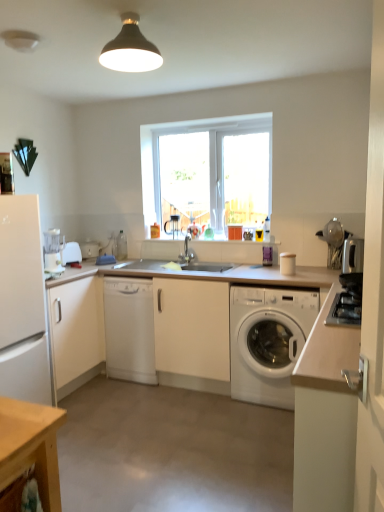
How much space does white plastic toaster at left, placed as the first appliance when sorted from back to front, occupy vertically?

The height of white plastic toaster at left, placed as the first appliance when sorted from back to front, is 18.63 centimeters.

Locate an element on the screen. matte black lampshade at upper center is located at coordinates (130, 49).

The width and height of the screenshot is (384, 512). Describe the element at coordinates (160, 323) in the screenshot. I see `white matte countertop at center` at that location.

Measure the distance between matte silver faucet at center and camera.

The depth of matte silver faucet at center is 3.60 meters.

Where is `white matte cabinet at left, which is the 2th cabinetry from right to left`? white matte cabinet at left, which is the 2th cabinetry from right to left is located at coordinates (76, 333).

Find the location of a particular element. The image size is (384, 512). white plastic toaster at left, placed as the first appliance when sorted from back to front is located at coordinates (70, 253).

Does white matte cabinet at left, which is the first cabinetry from left to right, come in front of transparent glass window at center?

Yes, white matte cabinet at left, which is the first cabinetry from left to right, is in front of transparent glass window at center.

Is white matte cabinet at left, which is the first cabinetry from left to right, oriented away from transparent glass window at center?

No, white matte cabinet at left, which is the first cabinetry from left to right,'s orientation is not away from transparent glass window at center.

Is white matte cabinet at left, which is the 2th cabinetry from right to left, bigger or smaller than transparent glass window at center?

In the image, white matte cabinet at left, which is the 2th cabinetry from right to left, appears to be larger than transparent glass window at center.

Measure the distance between white matte cabinet at left, the second cabinetry positioned from the front, and transparent glass window at center.

white matte cabinet at left, the second cabinetry positioned from the front, and transparent glass window at center are 4.01 feet apart.

Choose the correct answer: Is matte silver faucet at center inside satin silver gas stove at right or outside it?

matte silver faucet at center is not enclosed by satin silver gas stove at right.

Consider the image. Does matte silver faucet at center have a larger size compared to satin silver gas stove at right?

Yes.

Can you confirm if matte silver faucet at center is wider than satin silver gas stove at right?

Yes.

Is satin silver gas stove at right at the back of matte silver faucet at center?

No, satin silver gas stove at right is not at the back of matte silver faucet at center.

Considering the relative sizes of white matte countertop at center and white plastic washing machine at center in the image provided, is white matte countertop at center smaller than white plastic washing machine at center?

Actually, white matte countertop at center might be larger than white plastic washing machine at center.

Is white matte countertop at center at the right side of white plastic washing machine at center?

In fact, white matte countertop at center is to the left of white plastic washing machine at center.

Could you tell me if white matte countertop at center is turned towards white plastic washing machine at center?

Yes, white matte countertop at center is turned towards white plastic washing machine at center.

Are white matte countertop at center and white plastic washing machine at center beside each other?

white matte countertop at center and white plastic washing machine at center are not in contact.

Is white matte dishwasher at center taller or shorter than satin silver toaster at right, the first appliance when ordered from right to left?

In the image, white matte dishwasher at center appears to be taller than satin silver toaster at right, the first appliance when ordered from right to left.

From the image's perspective, relative to satin silver toaster at right, the first appliance when ordered from right to left, is white matte dishwasher at center above or below?

Based on their image positions, white matte dishwasher at center is located beneath satin silver toaster at right, the first appliance when ordered from right to left.

Is white matte dishwasher at center far from satin silver toaster at right, which is counted as the third appliance, starting from the left?

Yes, white matte dishwasher at center is far from satin silver toaster at right, which is counted as the third appliance, starting from the left.

Does white matte dishwasher at center turn towards satin silver toaster at right, the first appliance when ordered from right to left?

No, white matte dishwasher at center does not turn towards satin silver toaster at right, the first appliance when ordered from right to left.

Is satin silver toaster at right, which is counted as the third appliance, starting from the left, positioned in front of metallic silver spoon at upper right, which appears as the second appliance when viewed from the back?

Yes, satin silver toaster at right, which is counted as the third appliance, starting from the left, is closer to the camera.

Between satin silver toaster at right, the first appliance when ordered from right to left, and metallic silver spoon at upper right, which is counted as the second appliance, starting from the left, which one appears on the left side from the viewer's perspective?

From the viewer's perspective, metallic silver spoon at upper right, which is counted as the second appliance, starting from the left, appears more on the left side.

Is satin silver toaster at right, the first appliance when ordered from right to left, with metallic silver spoon at upper right, which appears as the second appliance when viewed from the front?

They are not placed beside each other.

How far apart are satin silver toaster at right, the third appliance from the back, and metallic silver spoon at upper right, which appears as the second appliance when viewed from the front?

They are 7.35 inches apart.

From the picture: Is matte silver faucet at center facing towards white matte cabinet at left, which is the first cabinetry from left to right?

No, matte silver faucet at center is not oriented towards white matte cabinet at left, which is the first cabinetry from left to right.

Would you say matte silver faucet at center is outside white matte cabinet at left, which is the first cabinetry from left to right?

matte silver faucet at center lies outside white matte cabinet at left, which is the first cabinetry from left to right,'s area.

From a real-world perspective, is matte silver faucet at center positioned over white matte cabinet at left, the second cabinetry positioned from the front, based on gravity?

Yes, from a real-world perspective, matte silver faucet at center is over white matte cabinet at left, the second cabinetry positioned from the front

Which is further, (154, 168) or (317, 440)?

The point (154, 168) is farther.

From the image's perspective, is transparent glass window at center on white matte cabinet at right, which is the 2th cabinetry in back-to-front order?

Yes.

Could you measure the distance between transparent glass window at center and white matte cabinet at right, the first cabinetry positioned from the right?

A distance of 7.68 feet exists between transparent glass window at center and white matte cabinet at right, the first cabinetry positioned from the right.

Who is more distant, transparent glass window at center or white matte cabinet at right, which is the 2th cabinetry in back-to-front order?

transparent glass window at center is more distant.

Where is `window above the white matte cabinet at left, the second cabinetry positioned from the front (from the image's perspective)`? window above the white matte cabinet at left, the second cabinetry positioned from the front (from the image's perspective) is located at coordinates (208, 170).

In order to click on tap behind the satin silver gas stove at right in this screenshot , I will do `click(186, 252)`.

From the image, which object appears to be farther from matte black lampshade at upper center, white matte cabinet at left, which appears as the first cabinetry when viewed from the back, or metallic silver spoon at upper right, which is the second appliance from right to left?

white matte cabinet at left, which appears as the first cabinetry when viewed from the back, is positioned further to the anchor matte black lampshade at upper center.

Based on their spatial positions, is matte silver faucet at center or white matte countertop at center further from transparent glass window at center?

white matte countertop at center is positioned further to the anchor transparent glass window at center.

In the scene shown: Looking at the image, which one is located further to white matte countertop at center, matte black lampshade at upper center or satin silver toaster at right, the first appliance when ordered from right to left?

Among the two, matte black lampshade at upper center is located further to white matte countertop at center.

Considering their positions, is white plastic toaster at left, positioned as the 1th appliance in left-to-right order, positioned closer to white plastic washing machine at center than transparent glass window at center?

transparent glass window at center.

Based on the photo, looking at the image, which one is located further to matte silver faucet at center, metallic silver spoon at upper right, which appears as the second appliance when viewed from the back, or white matte cabinet at right, which is counted as the second cabinetry, starting from the left?

Among the two, white matte cabinet at right, which is counted as the second cabinetry, starting from the left, is located further to matte silver faucet at center.

Considering their positions, is metallic silver spoon at upper right, which is the second appliance from right to left, positioned further to white matte refrigerator at left than white matte cabinet at left, which appears as the first cabinetry when viewed from the back?

metallic silver spoon at upper right, which is the second appliance from right to left.

When comparing their distances from satin silver gas stove at right, does matte silver faucet at center or white matte cabinet at left, which is the first cabinetry from left to right, seem closer?

The object closer to satin silver gas stove at right is matte silver faucet at center.

Based on their spatial positions, is white matte dishwasher at center or white matte cabinet at left, which is the first cabinetry from left to right, further from satin silver gas stove at right?

white matte cabinet at left, which is the first cabinetry from left to right, is further to satin silver gas stove at right.

Where is `kitchen appliance between white matte cabinet at left, which is the first cabinetry from left to right, and satin silver gas stove at right`? This screenshot has height=512, width=384. kitchen appliance between white matte cabinet at left, which is the first cabinetry from left to right, and satin silver gas stove at right is located at coordinates (52, 251).

The height and width of the screenshot is (512, 384). I want to click on dish washer located between white matte refrigerator at left and satin silver gas stove at right in the left-right direction, so click(x=129, y=329).

This screenshot has width=384, height=512. In order to click on tap between white plastic toaster at left and satin silver toaster at right, the third appliance from the back in this screenshot , I will do `click(186, 252)`.

You are a GUI agent. You are given a task and a screenshot of the screen. Output one action in this format:
    pyautogui.click(x=<x>, y=<y>)
    Task: Click on the washing machine positioned between white matte cabinet at right, which is the 2th cabinetry in back-to-front order, and metallic silver spoon at upper right, which appears as the second appliance when viewed from the back, from near to far
    
    Given the screenshot: What is the action you would take?
    pyautogui.click(x=268, y=341)